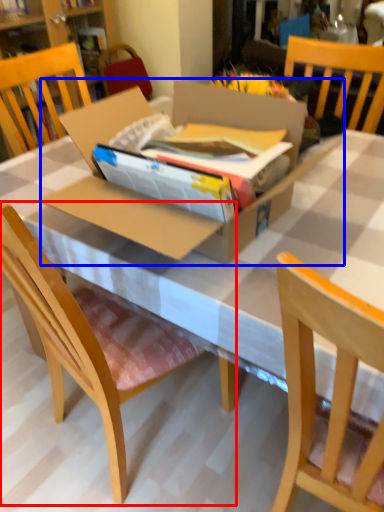
Question: Which object is closer to the camera taking this photo, chair (highlighted by a red box) or cardboard box (highlighted by a blue box)?

Choices:
 (A) chair
 (B) cardboard box

Answer: (A)